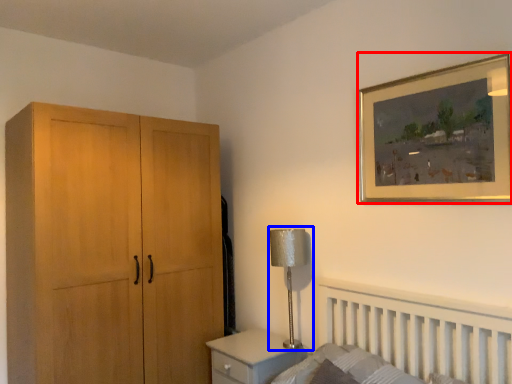
Question: Which object appears closest to the camera in this image, picture frame (highlighted by a red box) or table lamp (highlighted by a blue box)?

Choices:
 (A) picture frame
 (B) table lamp

Answer: (A)